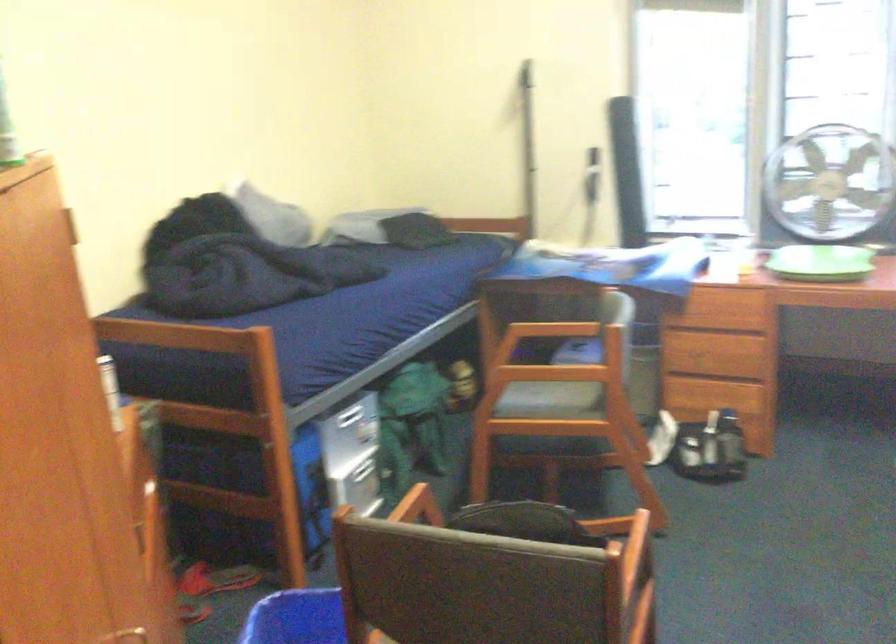
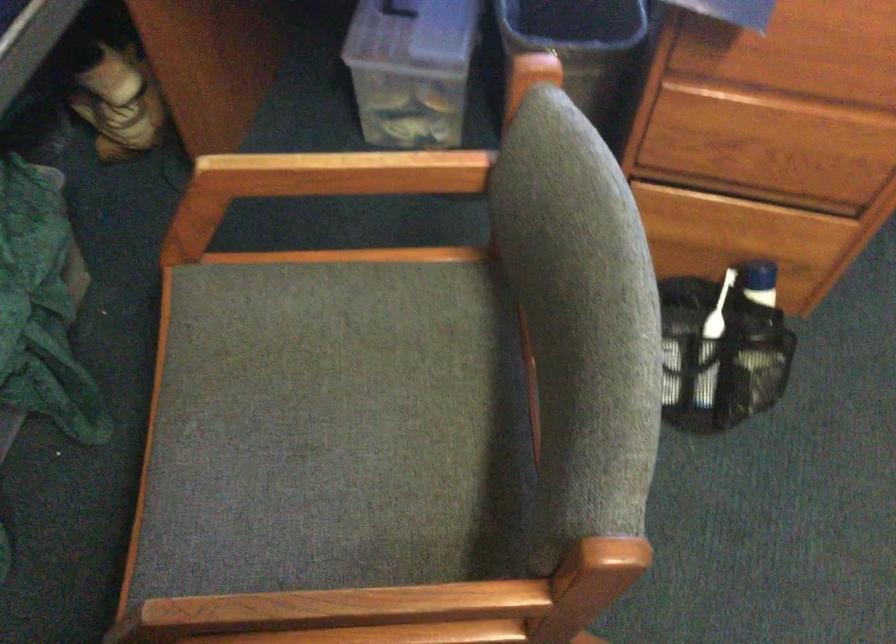
Locate, in the second image, the point that corresponds to point 656,343 in the first image.

(583, 49)